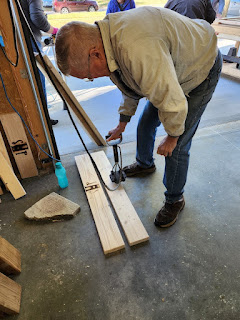
Where is `bottle`? This screenshot has height=320, width=240. bottle is located at coordinates (60, 174).